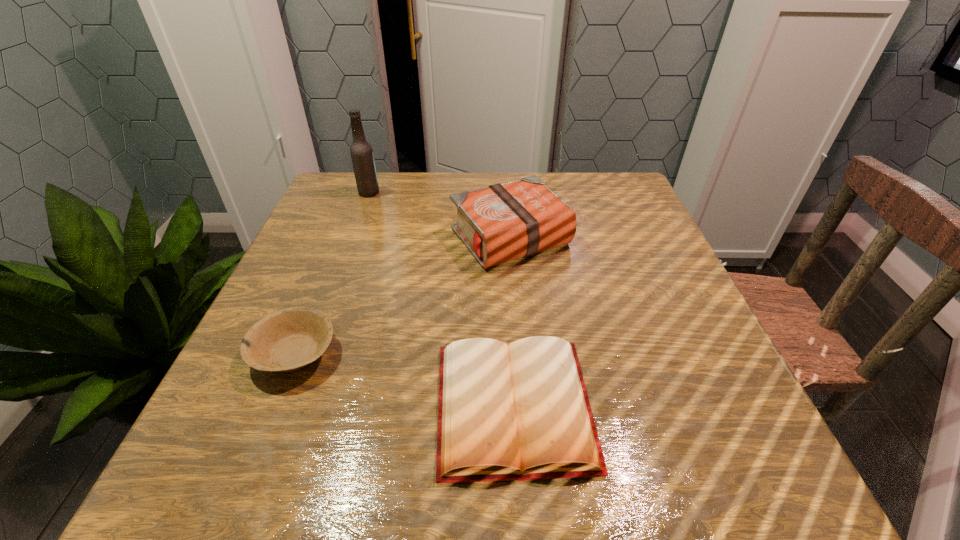
Locate an element on the screen. free space located 0.180m on the back of the nearer Bible is located at coordinates (505, 279).

Find the location of a particular element. This screenshot has width=960, height=540. beer bottle at the far edge is located at coordinates (361, 151).

Identify the location of Bible present at the far edge. (503, 222).

The width and height of the screenshot is (960, 540). Find the location of `object that is at the near edge`. object that is at the near edge is located at coordinates (521, 412).

The image size is (960, 540). Find the location of `beer bottle that is at the left edge`. beer bottle that is at the left edge is located at coordinates (361, 151).

This screenshot has height=540, width=960. I want to click on bowl positioned at the left edge, so click(x=287, y=340).

The image size is (960, 540). Identify the location of object at the far left corner. (361, 151).

The image size is (960, 540). In order to click on free space at the far edge in this screenshot , I will do `click(560, 172)`.

This screenshot has width=960, height=540. In the image, there is a desktop. What are the coordinates of `vacant region at the left edge` in the screenshot? It's located at (355, 280).

You are a GUI agent. You are given a task and a screenshot of the screen. Output one action in this format:
    pyautogui.click(x=<x>, y=<y>)
    Task: Click on the free space at the right edge
    
    Given the screenshot: What is the action you would take?
    pyautogui.click(x=725, y=430)